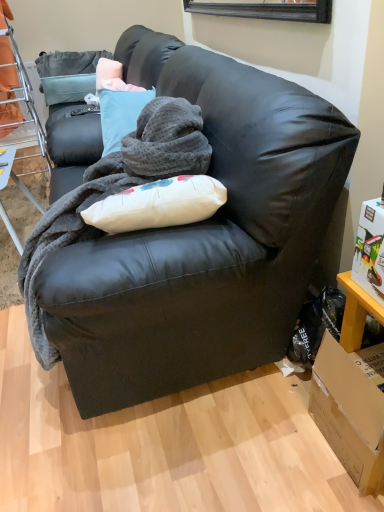
Question: Does orange fabric bunk bed at left have a lesser width compared to brown cardboard box at lower right?

Choices:
 (A) no
 (B) yes

Answer: (A)

Question: Is the depth of orange fabric bunk bed at left greater than that of brown cardboard box at lower right?

Choices:
 (A) no
 (B) yes

Answer: (B)

Question: Is orange fabric bunk bed at left shorter than brown cardboard box at lower right?

Choices:
 (A) no
 (B) yes

Answer: (A)

Question: Is orange fabric bunk bed at left positioned far away from brown cardboard box at lower right?

Choices:
 (A) yes
 (B) no

Answer: (A)

Question: Can you confirm if orange fabric bunk bed at left is taller than brown cardboard box at lower right?

Choices:
 (A) yes
 (B) no

Answer: (A)

Question: Is orange fabric bunk bed at left smaller than brown cardboard box at lower right?

Choices:
 (A) no
 (B) yes

Answer: (A)

Question: Is brown cardboard box at lower right aimed at matte black couch at center?

Choices:
 (A) yes
 (B) no

Answer: (B)

Question: From a real-world perspective, does brown cardboard box at lower right sit lower than matte black couch at center?

Choices:
 (A) yes
 (B) no

Answer: (A)

Question: Is brown cardboard box at lower right far from matte black couch at center?

Choices:
 (A) yes
 (B) no

Answer: (B)

Question: Is brown cardboard box at lower right smaller than matte black couch at center?

Choices:
 (A) yes
 (B) no

Answer: (A)

Question: Does brown cardboard box at lower right appear on the left side of matte black couch at center?

Choices:
 (A) no
 (B) yes

Answer: (A)

Question: Does brown cardboard box at lower right have a greater width compared to matte black couch at center?

Choices:
 (A) no
 (B) yes

Answer: (A)

Question: Does orange fabric bunk bed at left have a lesser height compared to metal mesh table at lower left?

Choices:
 (A) yes
 (B) no

Answer: (B)